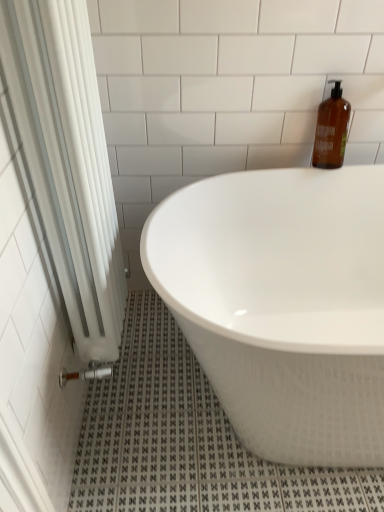
Question: Does white fabric shower curtain at left turn towards amber glass bottle at upper right?

Choices:
 (A) yes
 (B) no

Answer: (B)

Question: From a real-world perspective, is white fabric shower curtain at left located higher than amber glass bottle at upper right?

Choices:
 (A) yes
 (B) no

Answer: (B)

Question: Considering the relative sizes of white fabric shower curtain at left and amber glass bottle at upper right in the image provided, is white fabric shower curtain at left bigger than amber glass bottle at upper right?

Choices:
 (A) no
 (B) yes

Answer: (B)

Question: Can you confirm if white fabric shower curtain at left is wider than amber glass bottle at upper right?

Choices:
 (A) no
 (B) yes

Answer: (B)

Question: Does white fabric shower curtain at left lie in front of amber glass bottle at upper right?

Choices:
 (A) no
 (B) yes

Answer: (B)

Question: Is white fabric shower curtain at left taller than amber glass bottle at upper right?

Choices:
 (A) no
 (B) yes

Answer: (B)

Question: Is the position of white fabric shower curtain at left less distant than that of white glossy bathtub at center?

Choices:
 (A) yes
 (B) no

Answer: (A)

Question: Is white glossy bathtub at center at the back of white fabric shower curtain at left?

Choices:
 (A) no
 (B) yes

Answer: (A)

Question: Could you tell me if white fabric shower curtain at left is facing white glossy bathtub at center?

Choices:
 (A) no
 (B) yes

Answer: (B)

Question: Is white fabric shower curtain at left shorter than white glossy bathtub at center?

Choices:
 (A) yes
 (B) no

Answer: (B)

Question: Is white fabric shower curtain at left taller than white glossy bathtub at center?

Choices:
 (A) no
 (B) yes

Answer: (B)

Question: Can you confirm if white fabric shower curtain at left is wider than white glossy bathtub at center?

Choices:
 (A) no
 (B) yes

Answer: (A)

Question: From the image's perspective, would you say amber glass bottle at upper right is shown under white glossy bathtub at center?

Choices:
 (A) no
 (B) yes

Answer: (A)